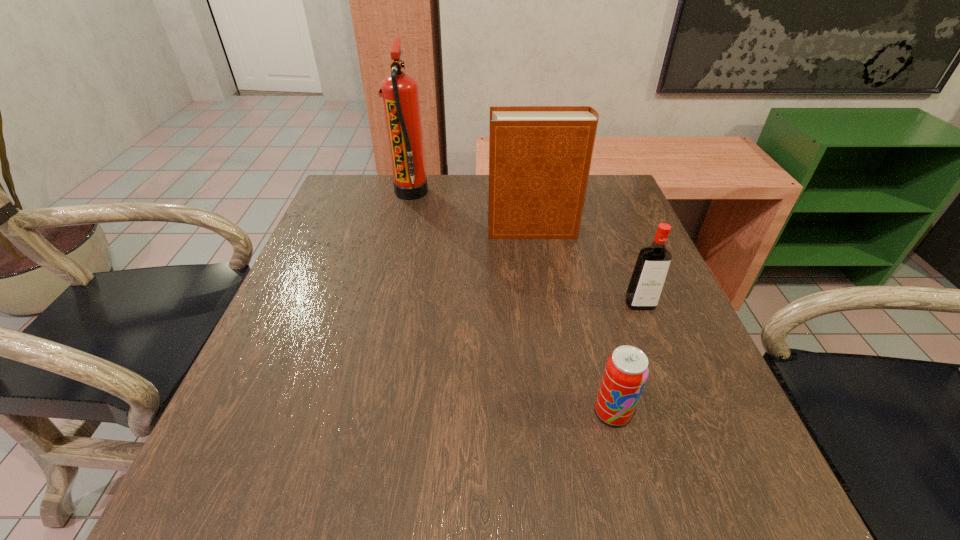
This screenshot has height=540, width=960. Find the location of `the farthest object`. the farthest object is located at coordinates (400, 93).

The height and width of the screenshot is (540, 960). I want to click on fire extinguisher, so click(400, 93).

Where is `hardback book`? hardback book is located at coordinates (539, 156).

The image size is (960, 540). In order to click on the third nearest object in this screenshot , I will do `click(539, 156)`.

At what (x,y) coordinates should I click in order to perform the action: click on the rightmost object. Please return your answer as a coordinate pair (x, y). This screenshot has width=960, height=540. Looking at the image, I should click on (648, 278).

Locate an element on the screen. Image resolution: width=960 pixels, height=540 pixels. the second nearest object is located at coordinates (648, 278).

Find the location of a particular element. soda can is located at coordinates point(626,371).

Locate an element on the screen. The width and height of the screenshot is (960, 540). the nearest object is located at coordinates (626, 371).

Identify the location of vacant space located 0.150m with the nozzle pointing from the back of the fire extinguisher. (481, 192).

What are the coordinates of `free spot located on the open cover of the third shortest object` in the screenshot? It's located at (345, 230).